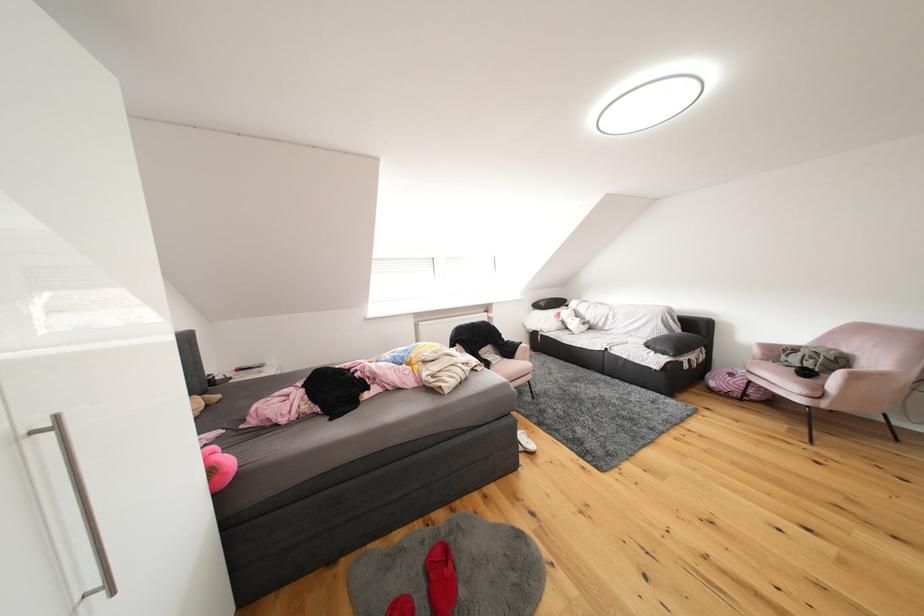
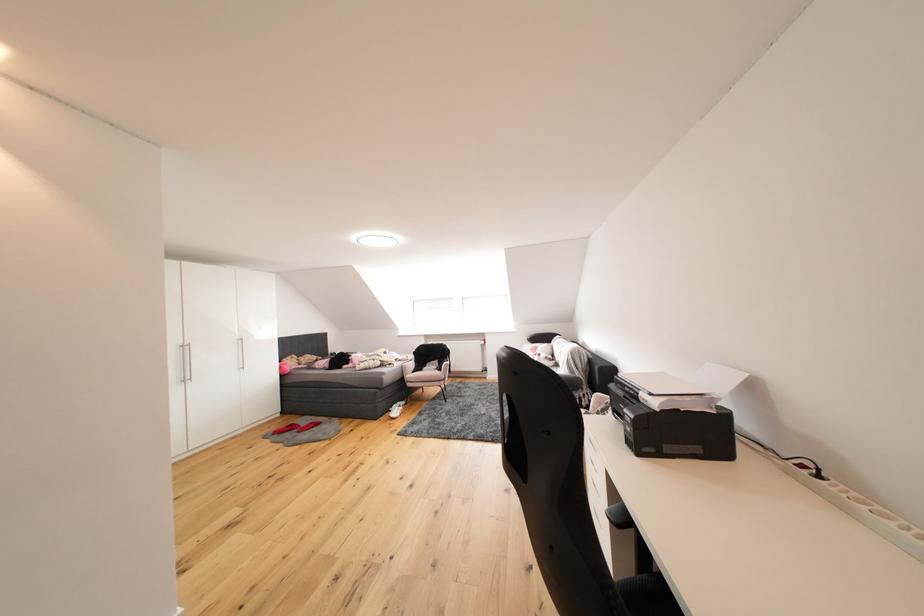
Question: I am providing you with two images of the same scene from different viewpoints. Which of the following objects are not visible in image2?

Choices:
 (A) red slipper
 (B) orange throw blanket
 (C) pink chair sitting surface
 (D) chair sitting surface

Answer: (C)